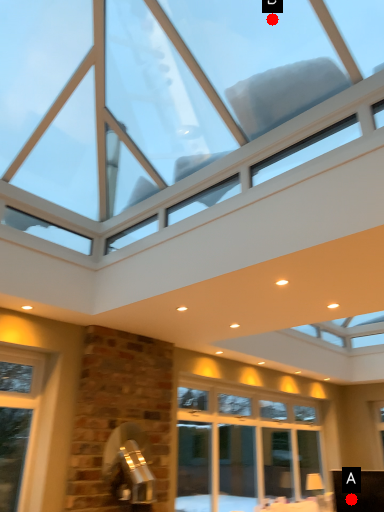
Question: Two points are circled on the image, labeled by A and B beside each circle. Which point is closer to the camera?

Choices:
 (A) A is closer
 (B) B is closer

Answer: (B)